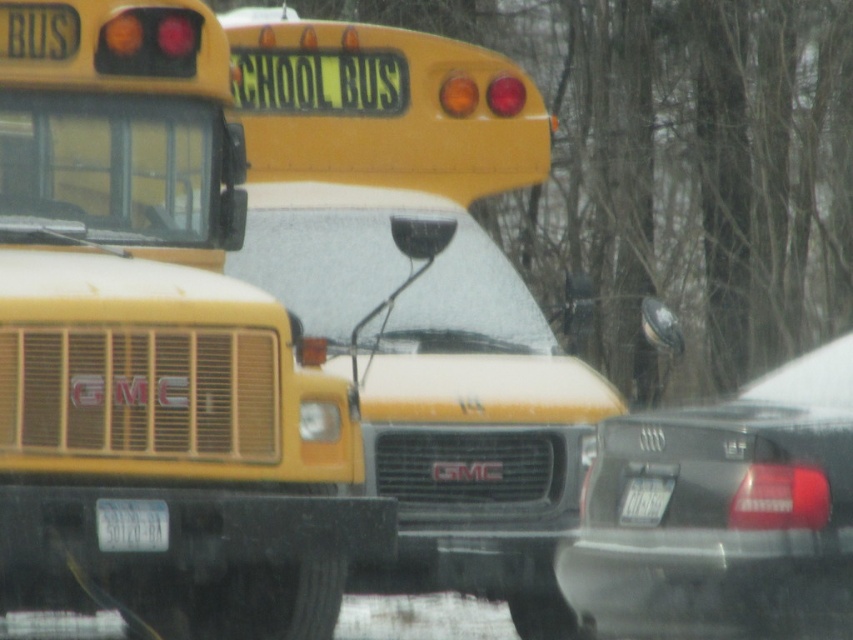
Question: Is yellow matte school bus at center above white plastic license plate at center?

Choices:
 (A) no
 (B) yes

Answer: (B)

Question: Which point appears closest to the camera in this image?

Choices:
 (A) (642, 484)
 (B) (351, 552)
 (C) (692, 570)
 (D) (155, 500)

Answer: (C)

Question: Can you confirm if matte black sedan at right is smaller than white plastic license plate at lower center?

Choices:
 (A) yes
 (B) no

Answer: (B)

Question: Is the position of yellow matte school bus at center more distant than that of white plastic license plate at lower center?

Choices:
 (A) yes
 (B) no

Answer: (B)

Question: Considering the real-world distances, which object is closest to the matte black sedan at right?

Choices:
 (A) white plastic license plate at center
 (B) white plastic license plate at lower center

Answer: (A)

Question: Which is nearer to the matte black sedan at right?

Choices:
 (A) yellow matte school bus at center
 (B) white plastic license plate at center

Answer: (B)